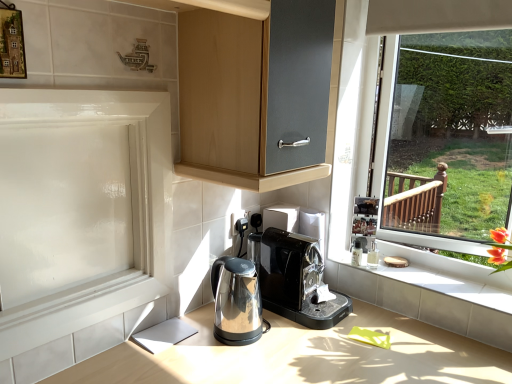
This screenshot has height=384, width=512. In order to click on vacant space that is in between stainless steel kettle at lower center, the second home appliance from the right, and black plastic coffee machine at center, marked as the 1th home appliance in a right-to-left arrangement in this screenshot , I will do `click(282, 340)`.